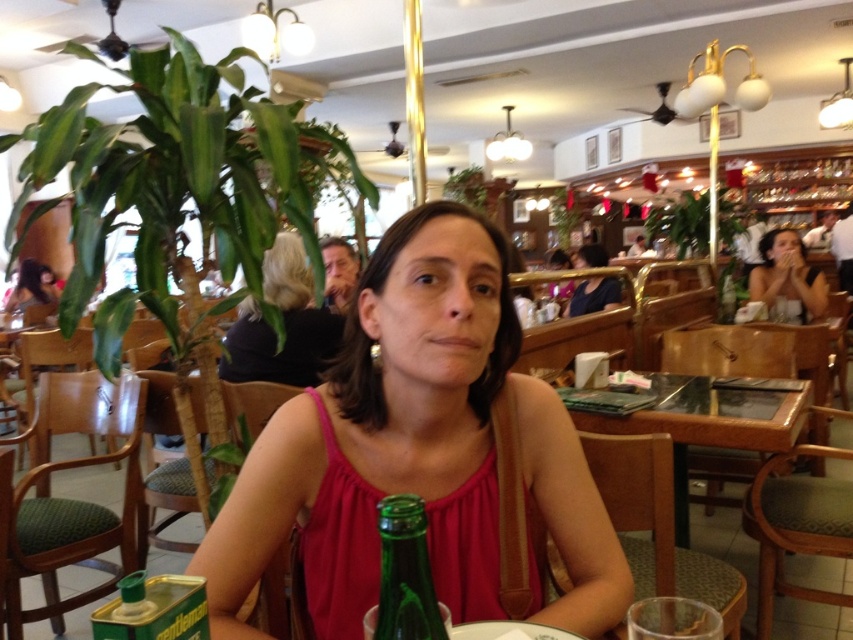
The height and width of the screenshot is (640, 853). What do you see at coordinates (416, 449) in the screenshot?
I see `pink fabric at center` at bounding box center [416, 449].

Who is more distant from viewer, (341, 484) or (749, 276)?

The point (749, 276) is behind.

This screenshot has height=640, width=853. I want to click on pink fabric at center, so click(416, 449).

Between pink fabric at center and matte black face at upper center, which one is positioned lower?

pink fabric at center

Is pink fabric at center below matte black face at upper center?

Correct, pink fabric at center is located below matte black face at upper center.

At what (x,y) coordinates should I click in order to perform the action: click on pink fabric at center. Please return your answer as a coordinate pair (x, y). The width and height of the screenshot is (853, 640). Looking at the image, I should click on point(416,449).

Looking at this image, is pink fabric at center shorter than matte black hair at upper left?

Incorrect, pink fabric at center's height does not fall short of matte black hair at upper left's.

Between point (305, 396) and point (33, 282), which one is positioned behind?

Positioned behind is point (33, 282).

Image resolution: width=853 pixels, height=640 pixels. I want to click on pink fabric at center, so click(416, 449).